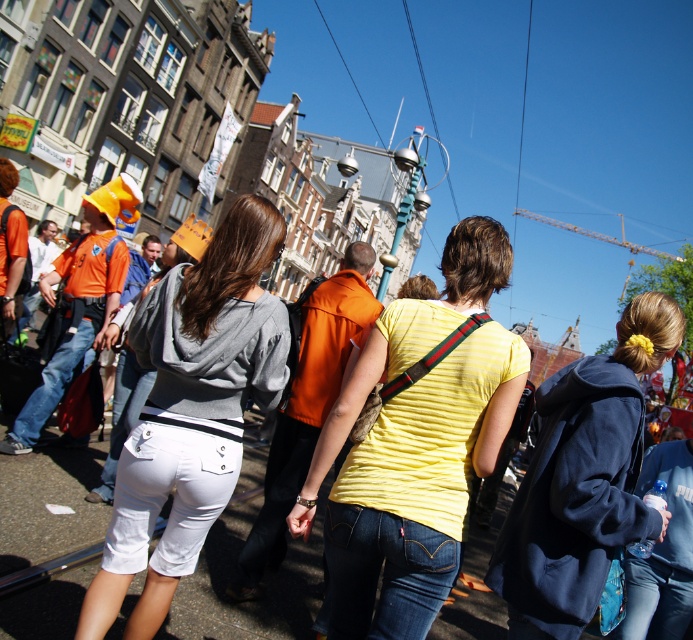
Is gray hoodie at center behind dark blue sweatshirt at center-right?

Yes, it is behind dark blue sweatshirt at center-right.

Looking at this image, does gray hoodie at center appear over dark blue sweatshirt at center-right?

Actually, gray hoodie at center is below dark blue sweatshirt at center-right.

At what (x,y) coordinates should I click in order to perform the action: click on gray hoodie at center. Please return your answer as a coordinate pair (x, y). The height and width of the screenshot is (640, 693). Looking at the image, I should click on (191, 412).

The image size is (693, 640). I want to click on gray hoodie at center, so click(191, 412).

Does yellow striped shirt at center have a lesser width compared to gray hoodie at center?

No.

Image resolution: width=693 pixels, height=640 pixels. I want to click on yellow striped shirt at center, so click(x=416, y=490).

Can you confirm if yellow striped shirt at center is positioned to the left of dark blue sweatshirt at center-right?

Yes, yellow striped shirt at center is to the left of dark blue sweatshirt at center-right.

Between point (432, 596) and point (516, 611), which one is positioned behind?

The point (516, 611) is more distant.

At what (x,y) coordinates should I click in order to perform the action: click on yellow striped shirt at center. Please return your answer as a coordinate pair (x, y). The height and width of the screenshot is (640, 693). Looking at the image, I should click on (416, 490).